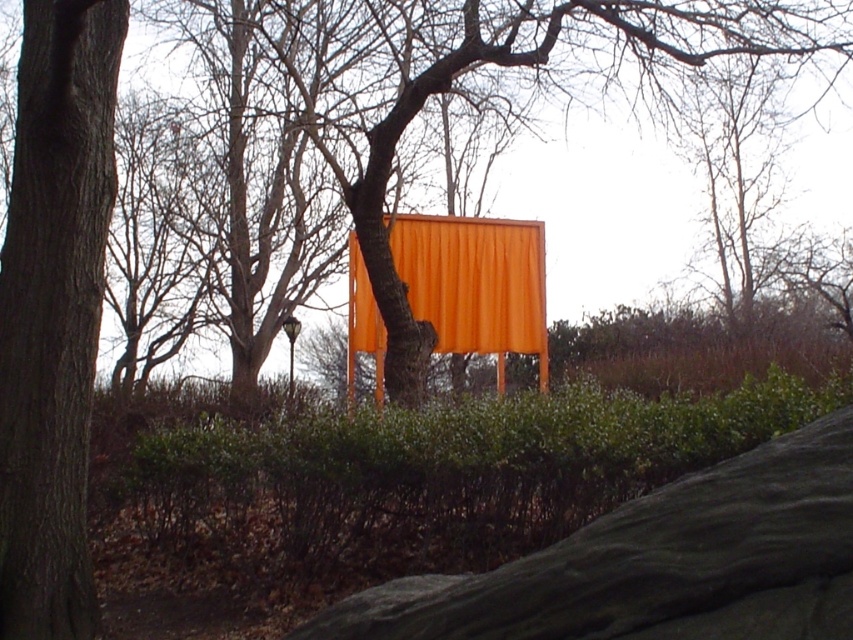
You are a painter setting up an easel to paint the scene. You want to ensure that both the smooth gray rock at center and the orange matte curtain at center are clearly visible in your painting. Given their sizes, which object should you place closer to the front of your composition to maintain their visibility?

The smooth gray rock at center is smaller than the orange matte curtain at center, so to maintain visibility, the smooth gray rock at center should be placed closer to the front of the composition.

You are standing in the outdoor scene and want to find the smooth brown tree trunk at left. Based on its position, which direction should you look to locate it?

The smooth brown tree trunk at left is located at point (x=54, y=310), which means it is positioned on the left side of the scene. You should look to your left to find it.

You are an artist setting up an easel to paint the scene. You want to capture both the smooth gray rock at center and the smooth brown tree trunk at left in your painting. Which object should you position closer to the front of your canvas to maintain their relative sizes as seen in the image?

The smooth gray rock at center should be positioned closer to the front of the canvas because it is not as tall as the smooth brown tree trunk at left, meaning it appears smaller and closer in the scene.